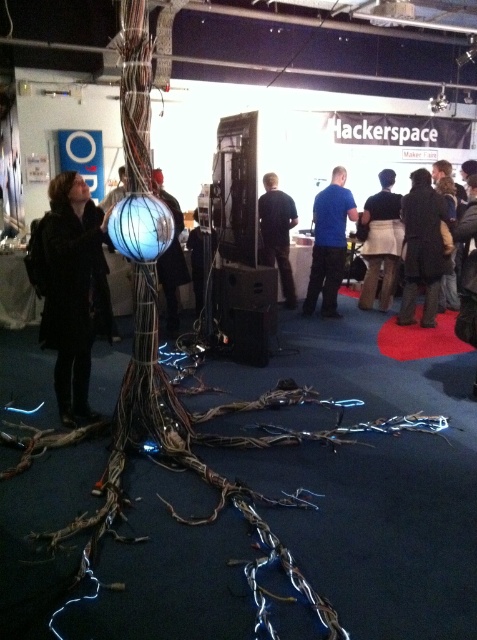
Is dark brown leather jacket at center taller than shiny metallic sphere at center?

Correct, dark brown leather jacket at center is much taller as shiny metallic sphere at center.

Can you confirm if dark brown leather jacket at center is shorter than shiny metallic sphere at center?

No.

Is point (412, 216) less distant than point (163, 198)?

No.

At what (x,y) coordinates should I click in order to perform the action: click on dark brown leather jacket at center. Please return your answer as a coordinate pair (x, y). Image resolution: width=477 pixels, height=640 pixels. Looking at the image, I should click on (422, 248).

Is shiny metallic sphere at center positioned at the back of dark blue fabric jacket at center?

No.

Does point (175, 220) lie in front of point (199, 260)?

Yes, point (175, 220) is in front of point (199, 260).

Image resolution: width=477 pixels, height=640 pixels. In order to click on shiny metallic sphere at center in this screenshot , I will do `click(170, 257)`.

Who is positioned more to the left, blue matte shirt at center or dark blue skirt at center?

Positioned to the left is blue matte shirt at center.

Can you confirm if blue matte shirt at center is taller than dark blue skirt at center?

Correct, blue matte shirt at center is much taller as dark blue skirt at center.

Between point (327, 252) and point (383, 260), which one is positioned in front?

Point (327, 252) is more forward.

What are the coordinates of `blue matte shirt at center` in the screenshot? It's located at (329, 243).